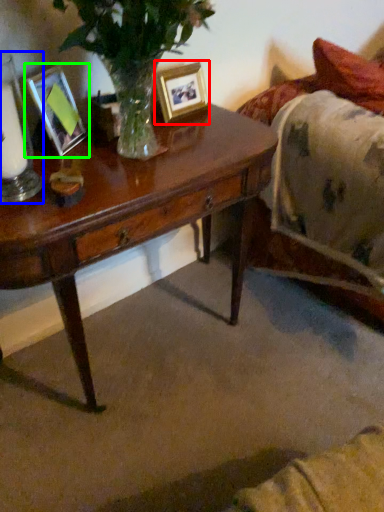
Question: Which object is the farthest from picture frame (highlighted by a red box)? Choose among these: candle holder (highlighted by a blue box) or picture frame (highlighted by a green box).

Choices:
 (A) candle holder
 (B) picture frame

Answer: (A)